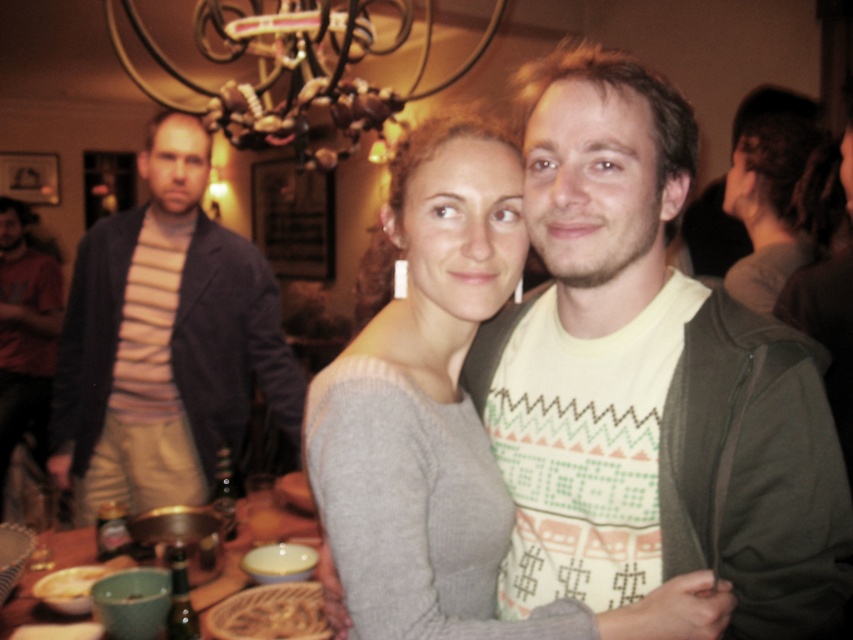
Based on the photo, which is above, knit sweater at center or wooden table at lower left?

knit sweater at center

Between point (749, 532) and point (260, 499), which one is positioned behind?

The point (260, 499) is behind.

Based on the photo, who is more distant from viewer, (659,586) or (305,488)?

The point (305,488) is more distant.

Identify the location of knit sweater at center. The image size is (853, 640). (647, 378).

Is point (222, 332) positioned after point (264, 493)?

Yes, it is behind point (264, 493).

Which of these two, striped knit sweater at left or wooden table at lower left, stands taller?

Standing taller between the two is striped knit sweater at left.

Is point (102, 476) positioned behind point (216, 580)?

Yes, point (102, 476) is behind point (216, 580).

At what (x,y) coordinates should I click in order to perform the action: click on striped knit sweater at left. Please return your answer as a coordinate pair (x, y). This screenshot has height=640, width=853. Looking at the image, I should click on (164, 340).

In the scene shown: Can you confirm if striped knit sweater at left is thinner than smooth brown rice at center?

No, striped knit sweater at left is not thinner than smooth brown rice at center.

Does striped knit sweater at left come in front of smooth brown rice at center?

No, striped knit sweater at left is behind smooth brown rice at center.

Who is more forward, (180, 296) or (83, 589)?

Point (83, 589) is in front.

Image resolution: width=853 pixels, height=640 pixels. I want to click on striped knit sweater at left, so click(164, 340).